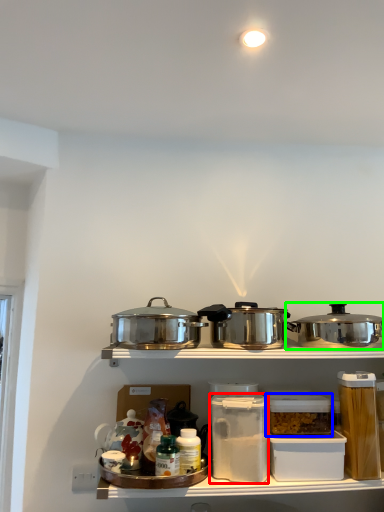
Question: Which object is positioned farthest from appliance (highlighted by a red box)? Select from appliance (highlighted by a blue box) and kitchen appliance (highlighted by a green box).

Choices:
 (A) appliance
 (B) kitchen appliance

Answer: (B)